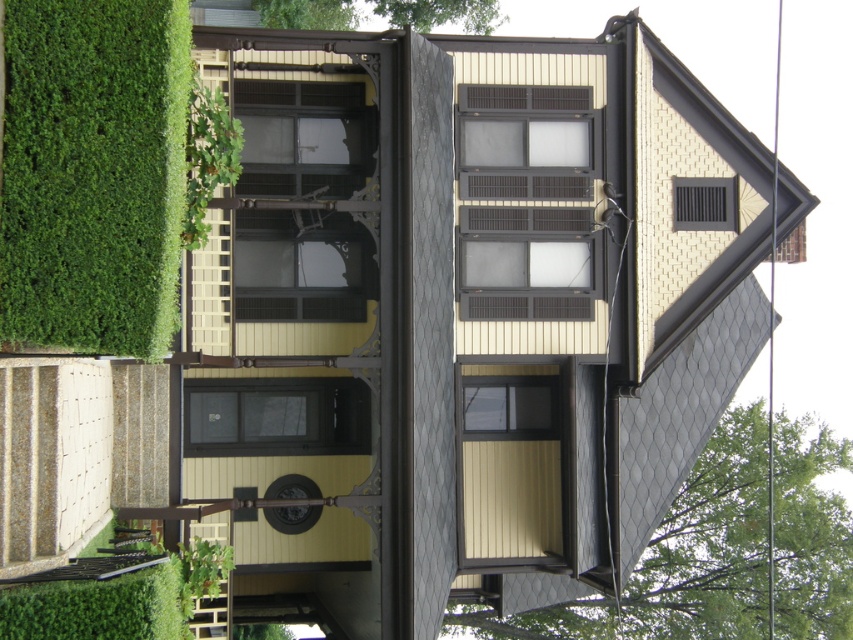
Question: Which object is farther from the camera taking this photo?

Choices:
 (A) green leafy hedge at left
 (B) green leafy hedge at lower left
 (C) green leafy tree at upper right
 (D) green leafy plant at upper left

Answer: (C)

Question: Which object appears closest to the camera in this image?

Choices:
 (A) green leafy tree at upper right
 (B) green leafy hedge at left
 (C) green leafy hedge at lower left
 (D) green leafy plant at upper left

Answer: (C)

Question: Is green leafy tree at upper right wider than green leafy hedge at lower left?

Choices:
 (A) no
 (B) yes

Answer: (B)

Question: Considering the real-world distances, which object is farthest from the green leafy plant at upper left?

Choices:
 (A) green leafy tree at upper right
 (B) green leafy hedge at lower left
 (C) green leafy hedge at left

Answer: (A)

Question: In this image, where is green leafy hedge at left located relative to green leafy tree at upper right?

Choices:
 (A) below
 (B) above

Answer: (B)

Question: Is green leafy hedge at lower left to the left of green leafy plant at upper left from the viewer's perspective?

Choices:
 (A) no
 (B) yes

Answer: (B)